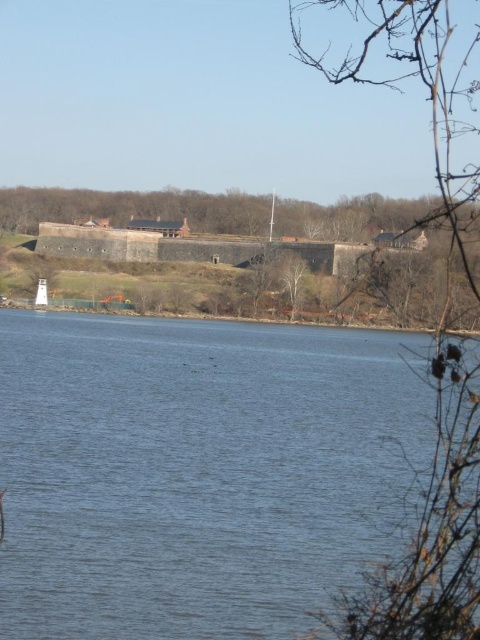
You are standing at the riverside and want to take a photo of both the blue water at center and the bare branches at center. Which object should you adjust your camera to focus on first if you want to capture both in the same frame?

You should focus on the blue water at center first because it is positioned to the left of the bare branches at center, so adjusting the camera to include both would require framing from left to right.

In the scene shown: In the riverside scene, the blue water at center and the bare branches at right are both visible. Which of these two elements takes up more space in the image?

The bare branches at right take up more space in the image since the blue water at center is smaller than the bare branches at right according to the description.

You are a landscape architect designing a walking path between the blue water at center and the bare branches at center. The path must be straight and 3 meters wide. Can you fit the path between them without overlapping either the water or the branches?

The distance between the blue water at center and the bare branches at center is 30.80 meters. Since the path needs to be 3 meters wide, the total required space would be 3 meters. Since 30.80 meters is greater than 3 meters, the path can be placed between them without overlapping either the water or the branches.